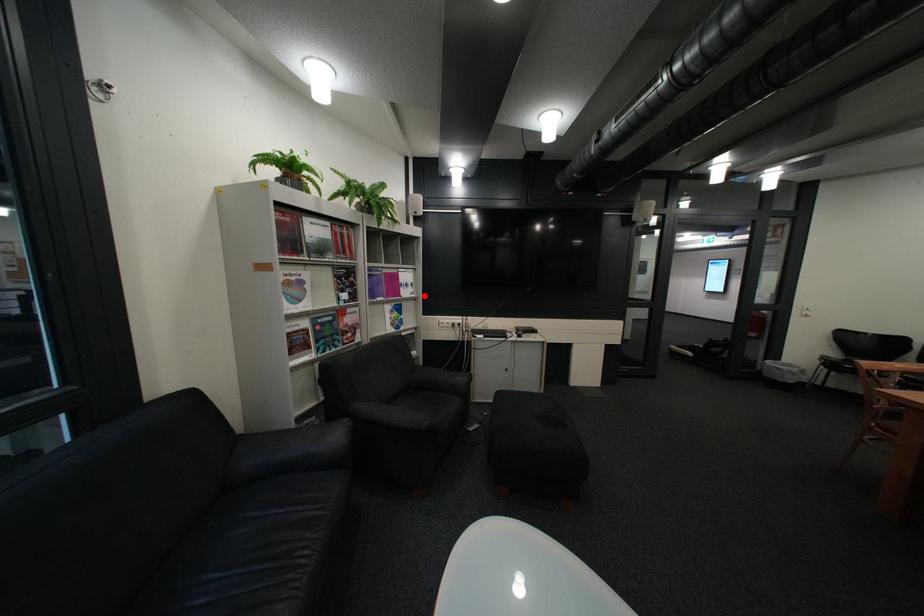
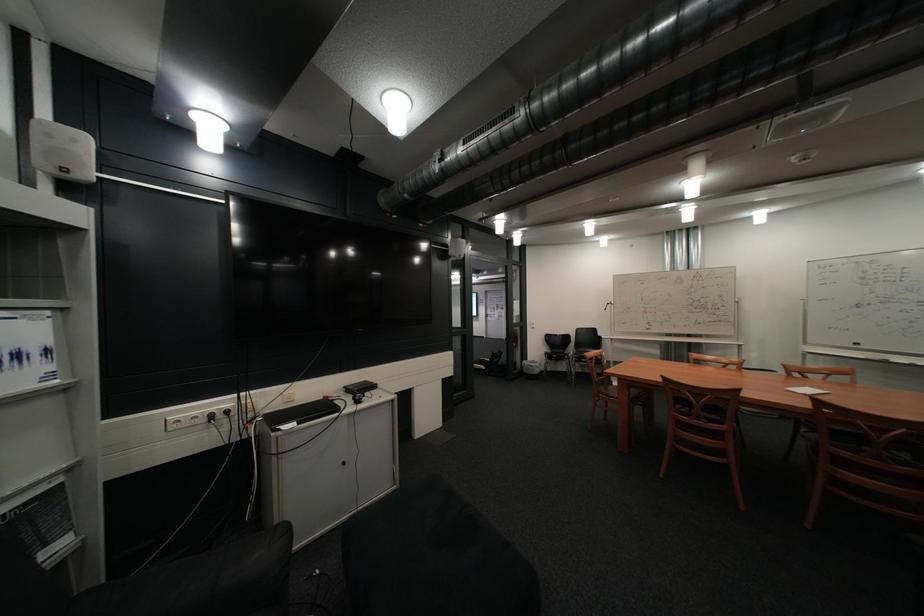
Locate, in the second image, the point that corresponds to the highlighted location in the first image.

(46, 386)